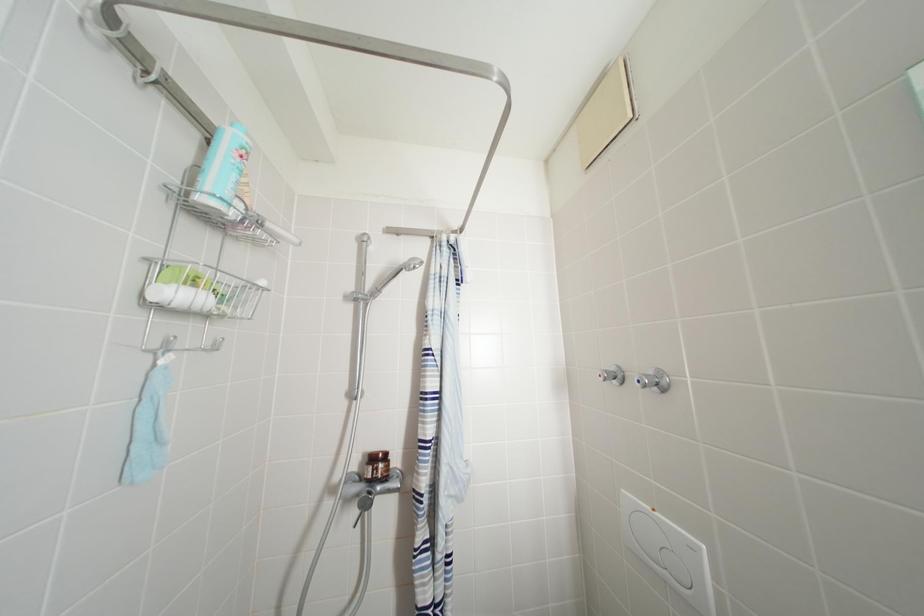
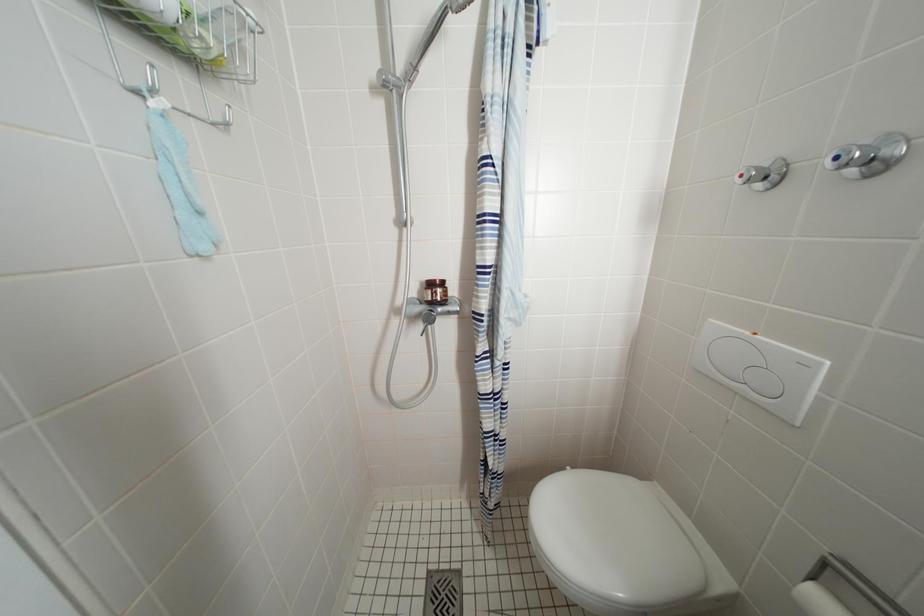
In a continuous first-person perspective shot, in which direction is the camera moving?

The movement direction of the cameraman is left, forward.